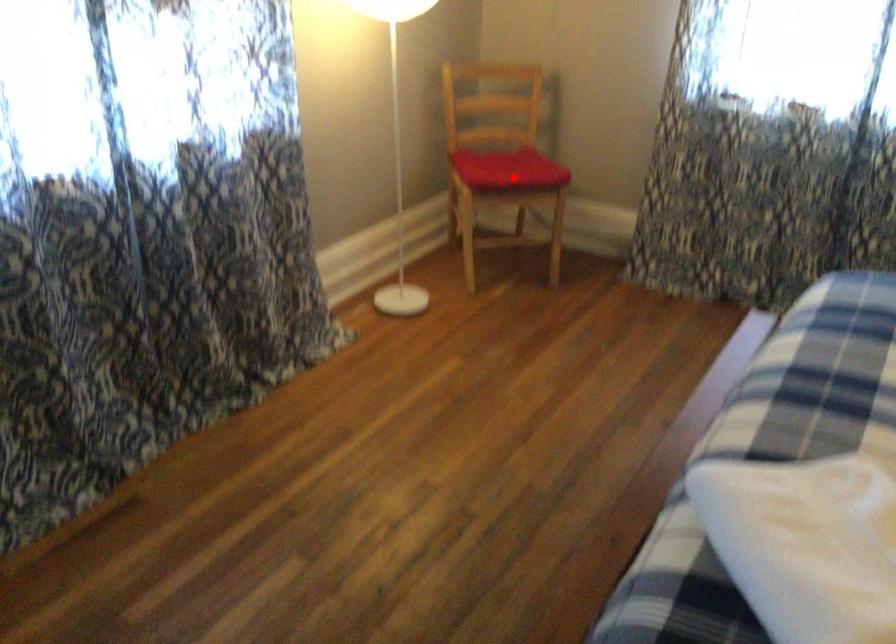
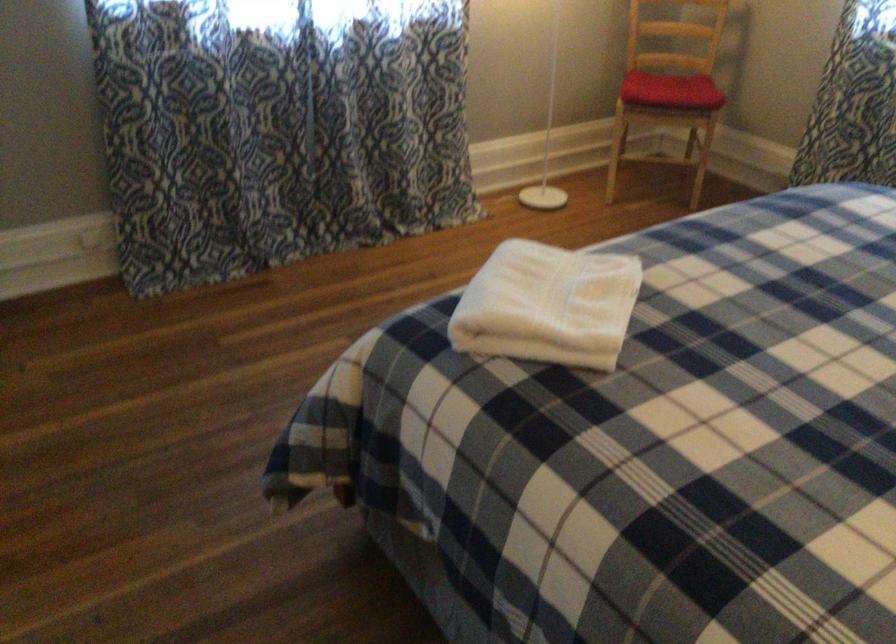
Find the pixel in the second image that matches the highlighted location in the first image.

(670, 90)